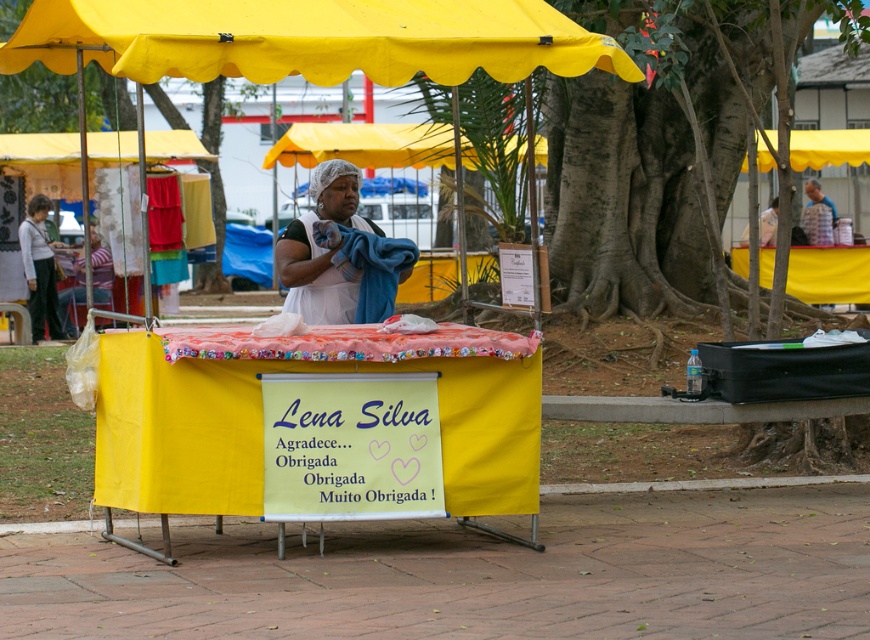
Does white fabric at center come behind yellow fabric canopy at upper left?

No, white fabric at center is closer to the viewer.

Is white fabric at center thinner than yellow fabric canopy at upper left?

Correct, white fabric at center's width is less than yellow fabric canopy at upper left's.

Does point (312, 296) lie in front of point (102, 136)?

Yes, point (312, 296) is closer to viewer.

Locate an element on the screen. The height and width of the screenshot is (640, 870). white fabric at center is located at coordinates (340, 253).

Where is `white fabric at center`? white fabric at center is located at coordinates (340, 253).

Can you confirm if white fabric at center is positioned below yellow fabric canopy at upper right?

Correct, white fabric at center is located below yellow fabric canopy at upper right.

Is point (389, 252) in front of point (761, 161)?

Yes, it is in front of point (761, 161).

Locate an element on the screen. white fabric at center is located at coordinates (340, 253).

In the scene shown: Is matte gray sweater at left taller than yellow fabric canopy at upper right?

Yes, matte gray sweater at left is taller than yellow fabric canopy at upper right.

Who is taller, matte gray sweater at left or yellow fabric canopy at upper right?

With more height is matte gray sweater at left.

Is point (42, 275) behind point (793, 156)?

No, (42, 275) is closer to viewer.

The width and height of the screenshot is (870, 640). What are the coordinates of `matte gray sweater at left` in the screenshot? It's located at (39, 269).